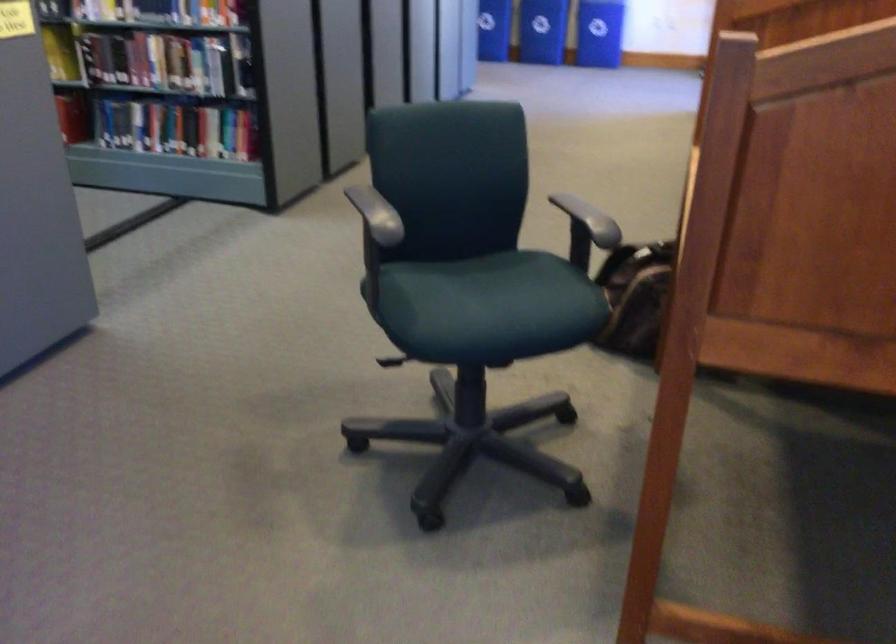
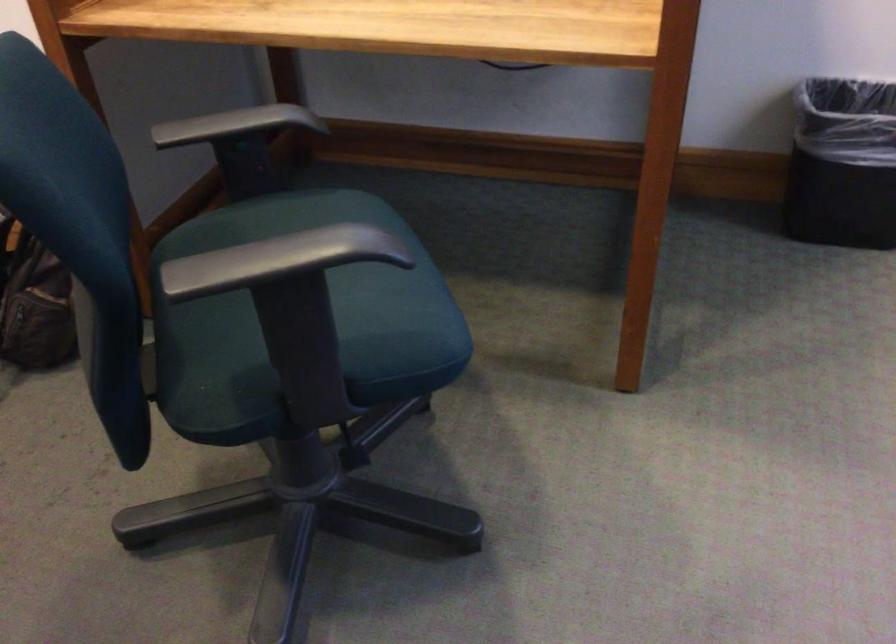
In the second image, find the point that corresponds to point 352,204 in the first image.

(250, 265)